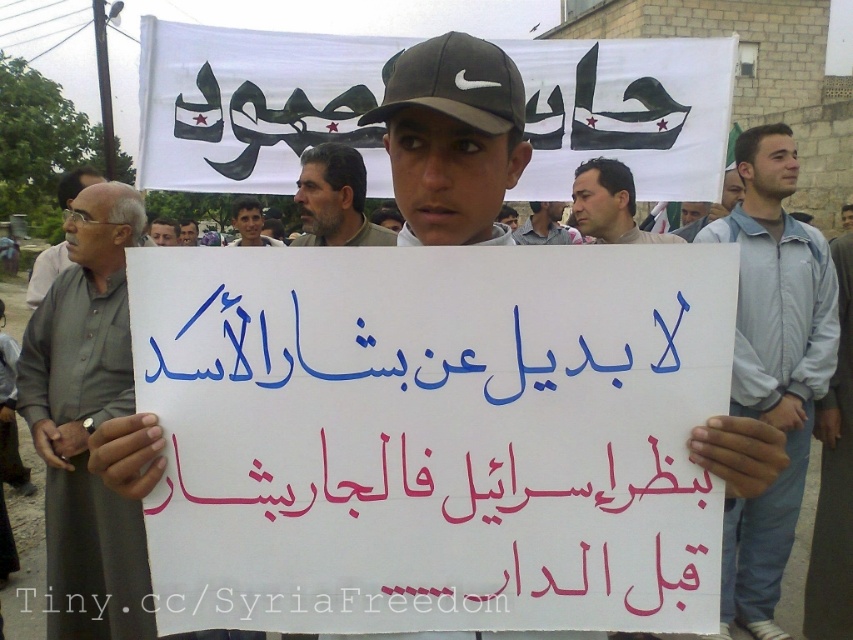
Question: Is gray fabric shirt at left to the left of light brown skin at center from the viewer's perspective?

Choices:
 (A) yes
 (B) no

Answer: (B)

Question: Does light blue jacket at center have a larger size compared to smooth beige shirt at center?

Choices:
 (A) yes
 (B) no

Answer: (A)

Question: Estimate the real-world distances between objects in this image. Which object is closer to the smooth skin face at center?

Choices:
 (A) light blue jacket at center
 (B) matte gray cap at upper center
 (C) light brown skin at center

Answer: (C)

Question: Which point appears closest to the camera in this image?

Choices:
 (A) (520, 230)
 (B) (577, 173)

Answer: (B)

Question: Does gray hair at center appear under light brown skin at center?

Choices:
 (A) no
 (B) yes

Answer: (B)

Question: Which point appears farthest from the camera in this image?

Choices:
 (A) (543, 227)
 (B) (264, 244)

Answer: (B)